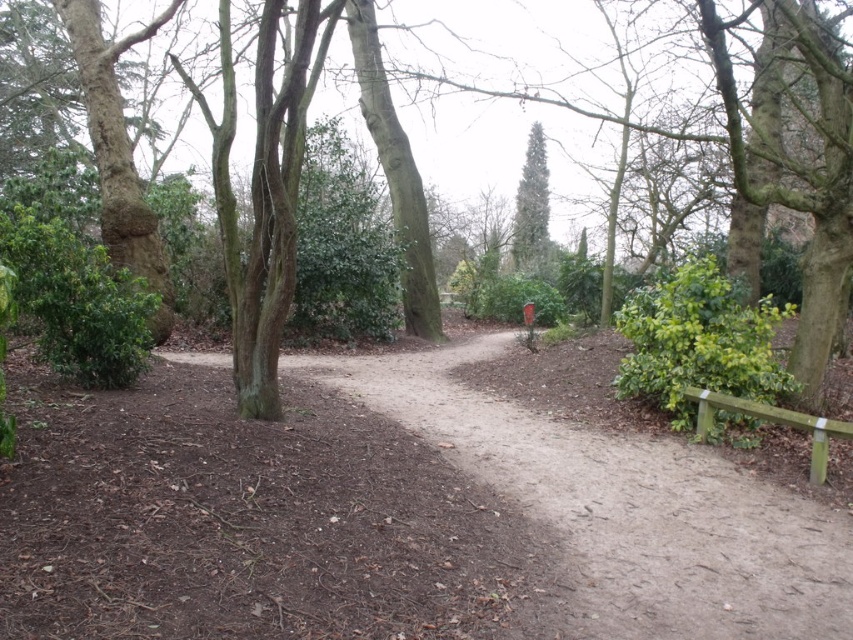
You are a hiker who wants to rest on the green wooden bench at right. Before sitting down, you notice the green glossy tree at center. Which object is taller?

The green glossy tree at center is taller than the green wooden bench at right.

You are a hiker who wants to rest on the green wooden bench at right. The green glossy tree at center is blocking your path. Can you walk around the tree to reach the bench?

The green glossy tree at center is larger than the green wooden bench at right, but since trees are typically solid objects, you cannot walk through them. You would need to go around the tree to reach the bench.

You are a hiker trying to determine the safest route through the dirt path at center and the green glossy tree at center. Which one is shorter in height?

The dirt path at center is not as tall as the green glossy tree at center, so the dirt path is shorter in height.